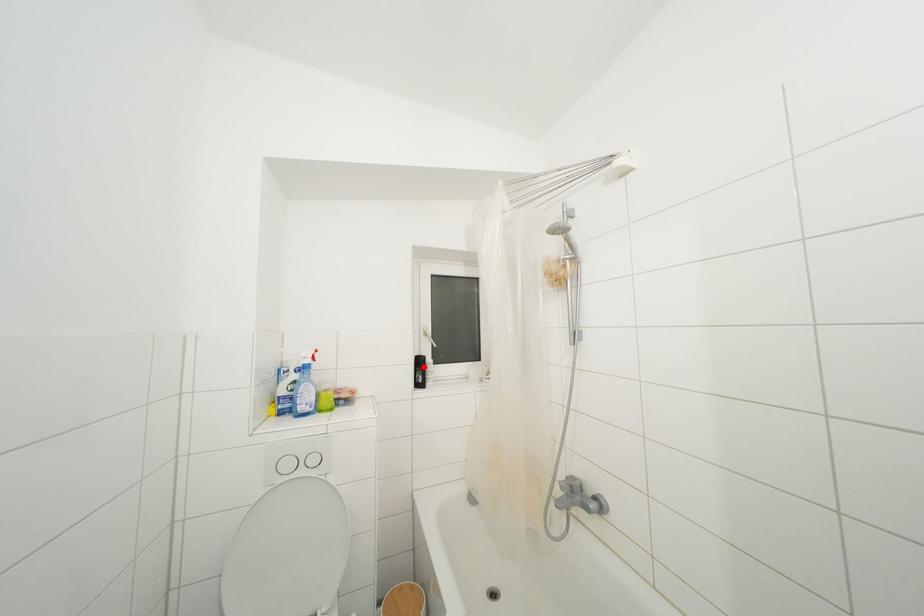
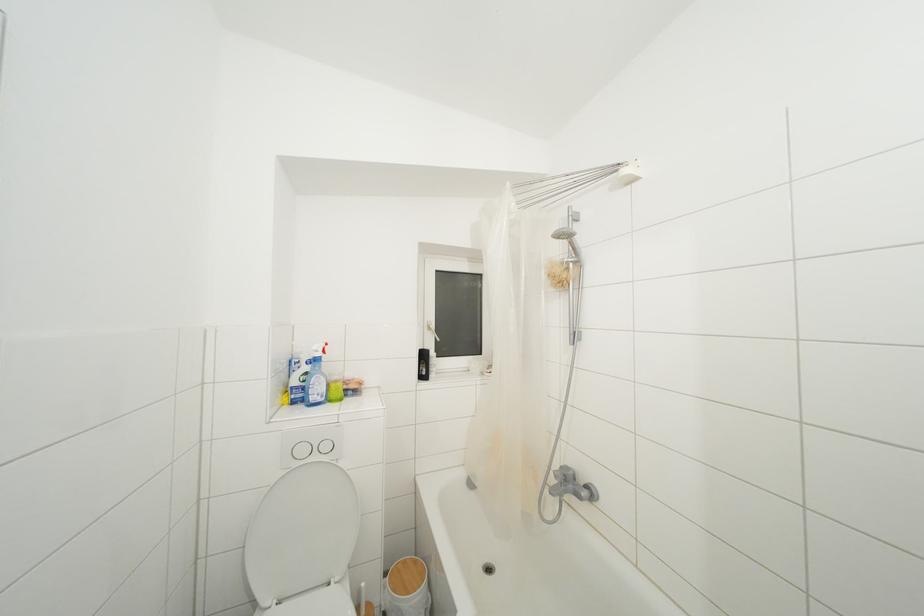
In the second image, find the point that corresponds to the highlighted location in the first image.

(428, 361)